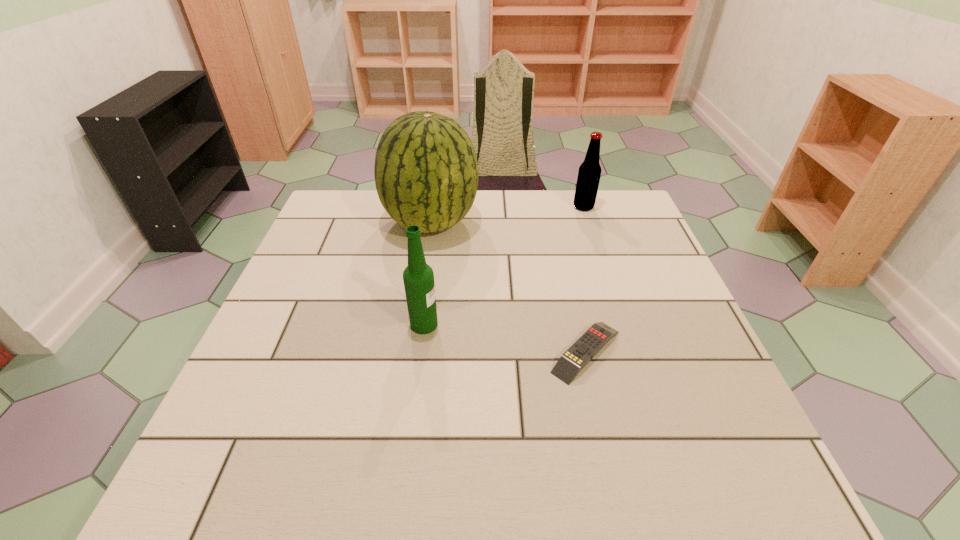
The image size is (960, 540). I want to click on watermelon, so [x=426, y=174].

The height and width of the screenshot is (540, 960). What are the coordinates of `the nearer beer bottle` in the screenshot? It's located at 418,277.

Image resolution: width=960 pixels, height=540 pixels. I want to click on the farther beer bottle, so click(589, 173).

The image size is (960, 540). I want to click on the shortest object, so click(x=595, y=338).

The width and height of the screenshot is (960, 540). I want to click on free space located 0.070m on the right of the watermelon, so click(503, 222).

Identify the location of vacant position located 0.160m on the label of the nearer beer bottle. The width and height of the screenshot is (960, 540). (511, 324).

I want to click on vacant region located on the front of the farther beer bottle, so click(x=616, y=307).

Locate an element on the screen. free location located 0.110m on the right of the shortest object is located at coordinates (678, 352).

Identify the location of watermelon present at the far edge. (426, 174).

The height and width of the screenshot is (540, 960). I want to click on beer bottle that is at the far edge, so click(x=589, y=173).